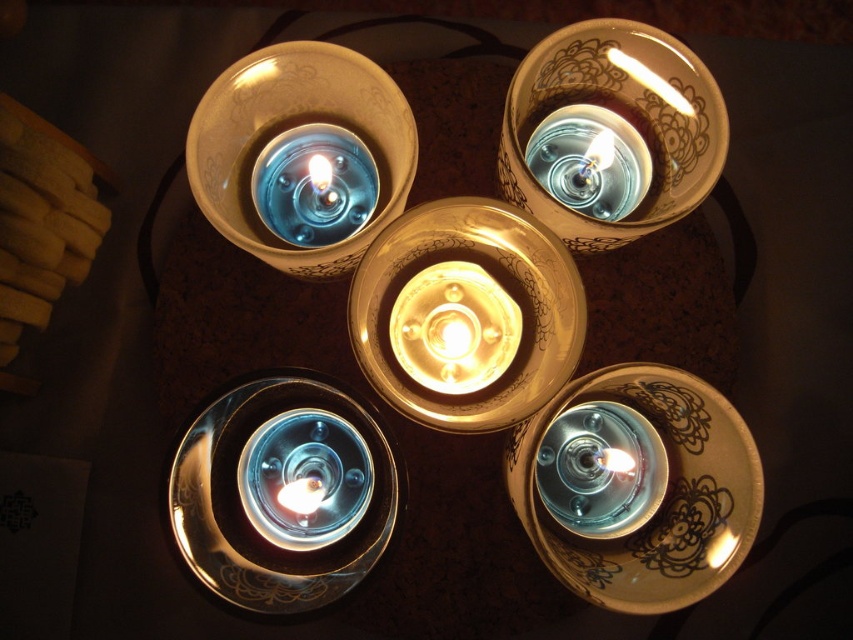
You are arranging candles for a dinner party and notice the matte ceramic candle holder at upper center and the translucent glass candle at upper center. Which of these two items is located to the left when viewed from above?

The matte ceramic candle holder at upper center is positioned on the left side of the translucent glass candle at upper center, so it is located to the left when viewed from above.

You are standing at the edge of the table where the bowls are placed. You need to place a new tealight candle exactly halfway between point A at point [361,113] and point B at point [628,186]. Which direction should you move from point A to reach the midpoint?

To find the midpoint between point A at point [361,113] and point B at point [628,186], you should move northeast from point A. This is because the midpoint calculation averages the coordinates, resulting in a position that is both eastward and northward from point A.

You are setting up a table for a dinner party and want to place a centerpiece between the metallic gold candle holder at bottom left and the matte ceramic candle holder at upper center. Based on their positions, where should you place the centerpiece?

The centerpiece should be placed between the metallic gold candle holder at bottom left and the matte ceramic candle holder at upper center, since the metallic gold candle holder at bottom left is to the left of the matte ceramic candle holder at upper center, so the midpoint between them would be the ideal location.